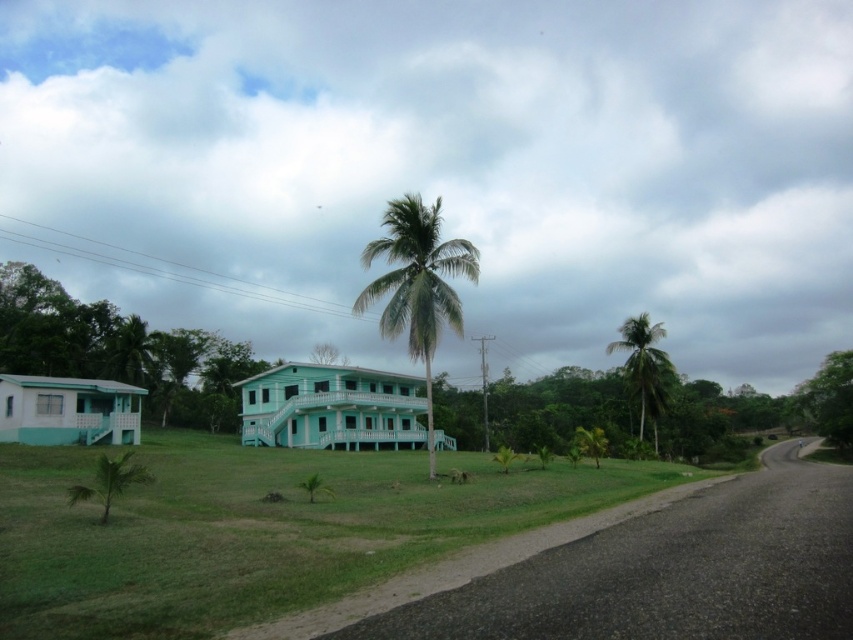
Question: Which point is farther from the camera taking this photo?

Choices:
 (A) 404,280
 (B) 640,314

Answer: (B)

Question: Which point is closer to the camera?

Choices:
 (A) (662, 352)
 (B) (445, 285)

Answer: (B)

Question: Does green leafy palm at center have a smaller size compared to green leafy palm tree at right?

Choices:
 (A) no
 (B) yes

Answer: (A)

Question: Observing the image, what is the correct spatial positioning of green leafy palm at center in reference to green leafy palm tree at right?

Choices:
 (A) left
 (B) right

Answer: (A)

Question: Is green leafy palm at center thinner than green leafy palm tree at right?

Choices:
 (A) no
 (B) yes

Answer: (B)